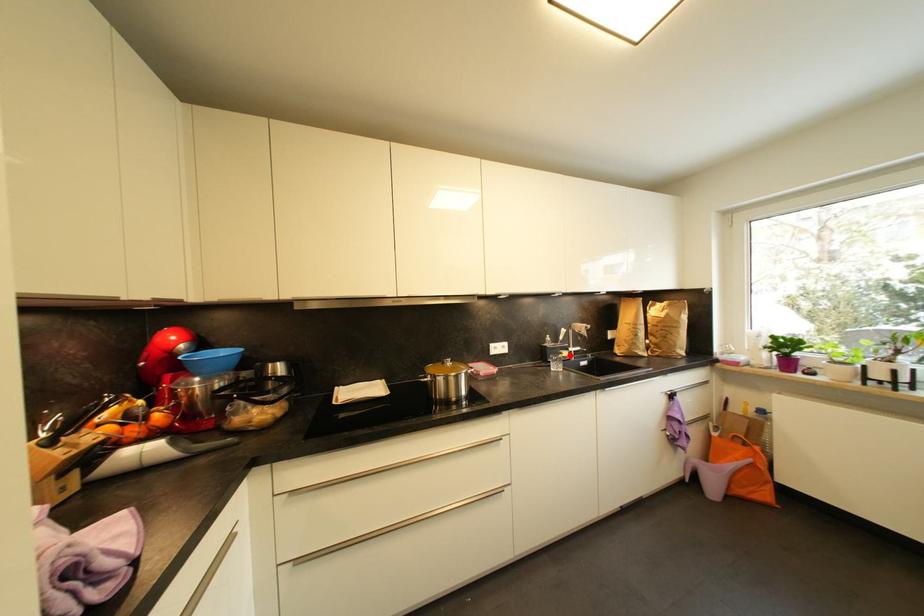
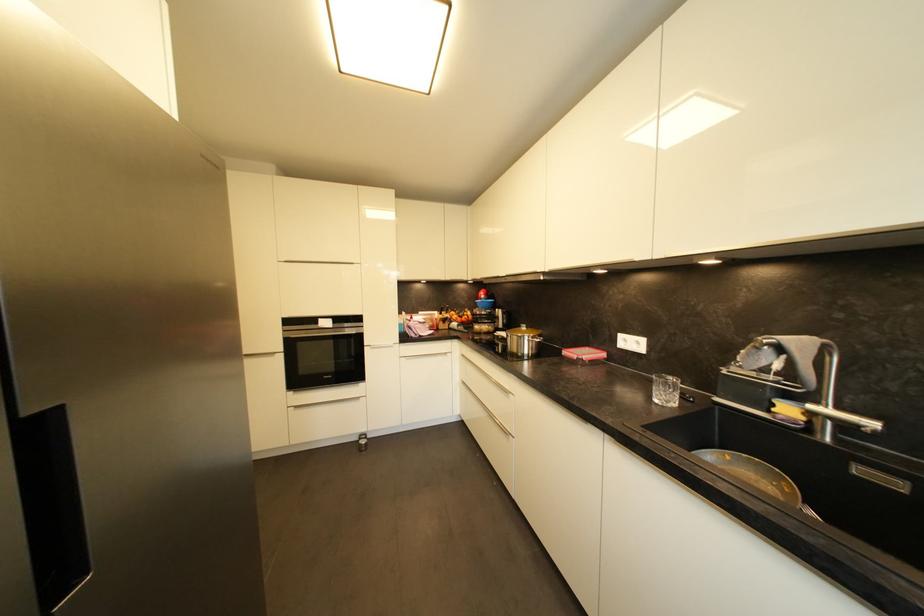
Where in the second image is the point corresponding to the highlighted location from the first image?

(793, 411)